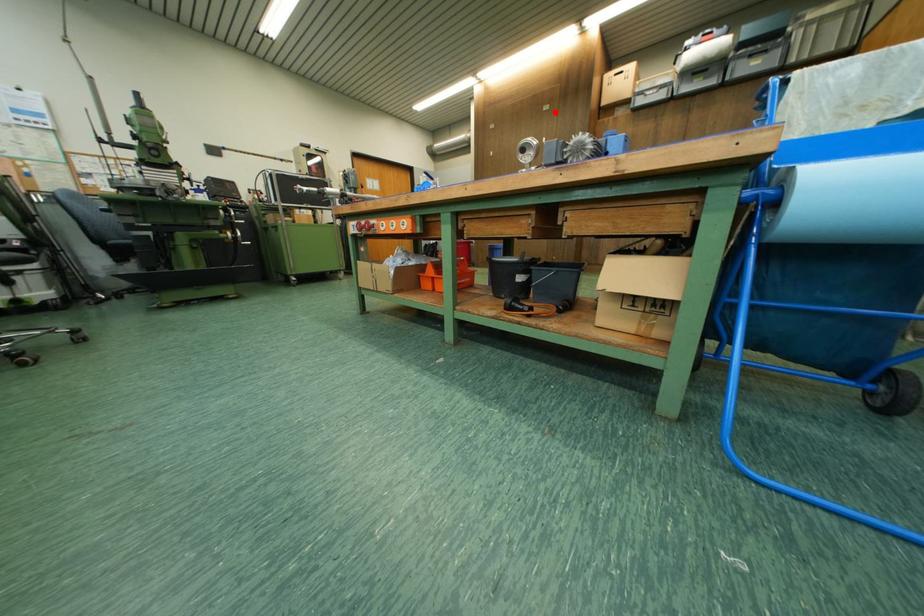
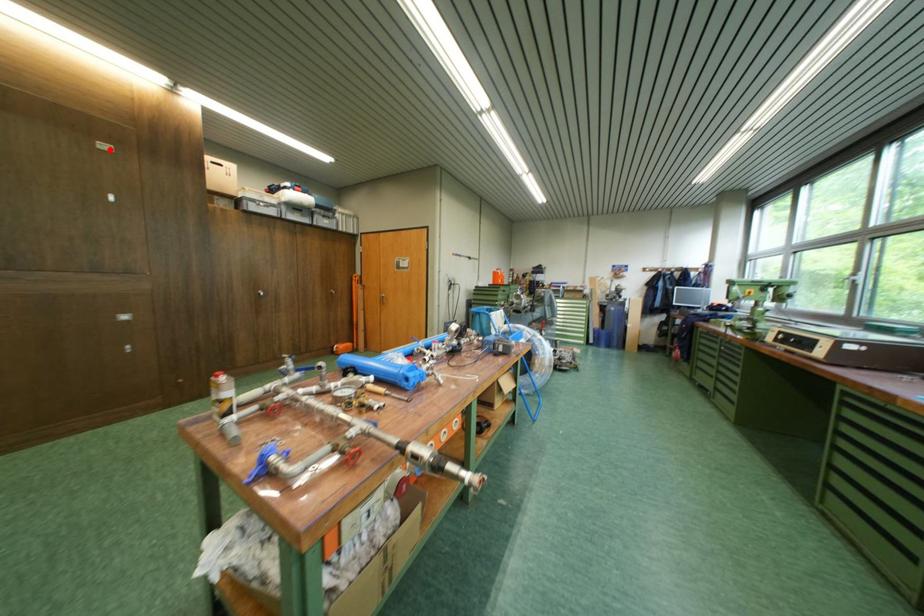
I am providing you with two images of the same scene from different viewpoints. A red point is marked on the first image and another point is marked on the second image. Does the point marked in image1 correspond to the same location as the one in image2?

Yes